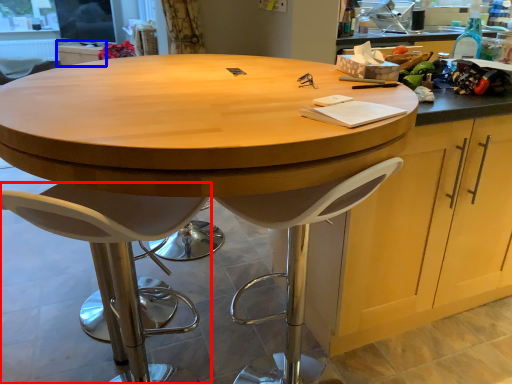
Question: Which of the following is the closest to the observer, chair (highlighted by a red box) or cabinetry (highlighted by a blue box)?

Choices:
 (A) chair
 (B) cabinetry

Answer: (A)